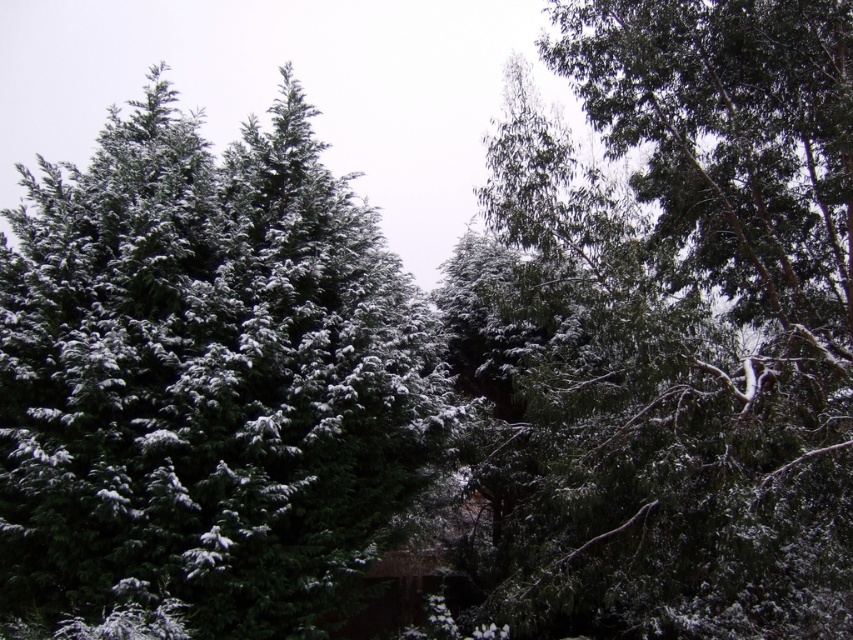
You are standing in the winter scene and want to locate the green matte tree at upper center. According to the coordinates provided, where exactly should you look to find it?

The green matte tree at upper center is located at point coordinates of 0.512 on the x axis and 0.800 on the y axis.

You are planning to place a 10 feet wide bench between the green matte tree at upper center and the green matte tree at upper left. Can the bench fit between them without touching either tree?

The distance between the green matte tree at upper center and the green matte tree at upper left is 22.82 feet. Since the bench is 10 feet wide, there is enough space to place it between them without touching either tree.